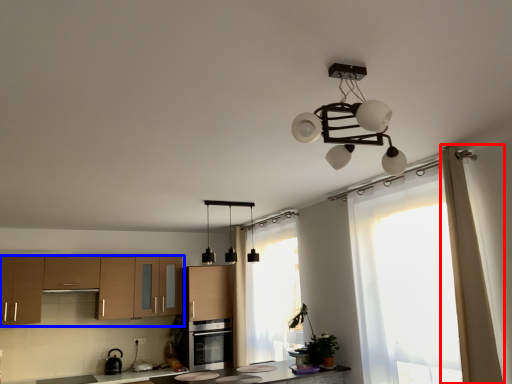
Question: Among these objects, which one is farthest to the camera, curtain (highlighted by a red box) or cabinetry (highlighted by a blue box)?

Choices:
 (A) curtain
 (B) cabinetry

Answer: (B)